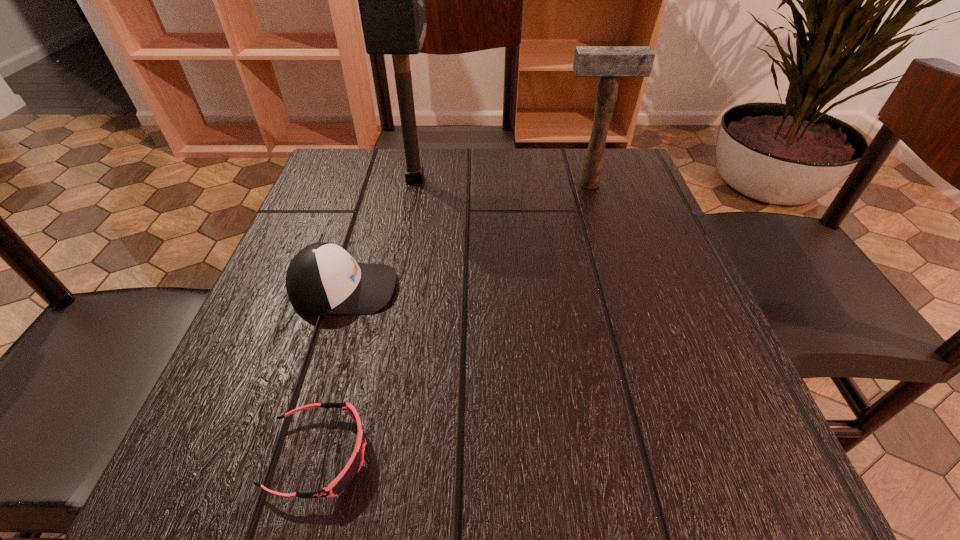
The height and width of the screenshot is (540, 960). I want to click on vacant space situated on the front panel of the third tallest object, so click(x=572, y=288).

Locate an element on the screen. free location located on the front-facing side of the shortest object is located at coordinates (677, 455).

I want to click on object that is at the near edge, so click(354, 464).

Locate an element on the screen. The width and height of the screenshot is (960, 540). cap at the left edge is located at coordinates (322, 278).

Where is `goggles present at the left edge`? The width and height of the screenshot is (960, 540). goggles present at the left edge is located at coordinates (354, 464).

Where is `object that is at the right edge`? The height and width of the screenshot is (540, 960). object that is at the right edge is located at coordinates (610, 63).

The image size is (960, 540). What are the coordinates of `object positioned at the near left corner` in the screenshot? It's located at (354, 464).

I want to click on object located in the far right corner section of the desktop, so click(610, 63).

Find the location of a particular element. The height and width of the screenshot is (540, 960). free space at the far edge of the desktop is located at coordinates (405, 168).

The width and height of the screenshot is (960, 540). Find the location of `vacant region at the near edge of the desktop`. vacant region at the near edge of the desktop is located at coordinates (445, 471).